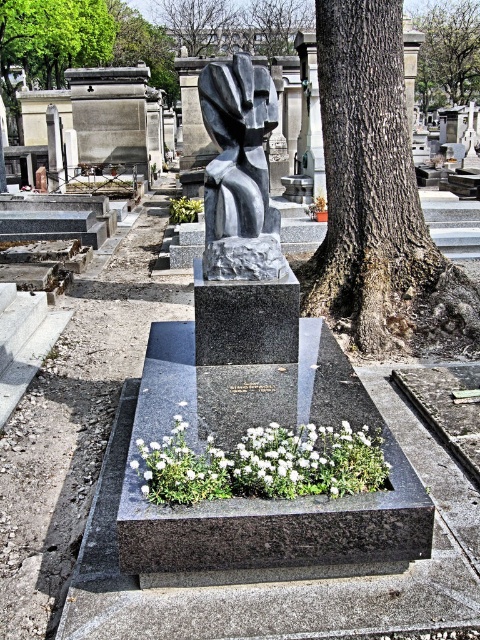
You are a visitor at the cemetery and want to take a photo of the green leafy tree at upper left and the brown textured tree at upper center. Which tree is closer to the camera?

The green leafy tree at upper left is positioned under the brown textured tree at upper center, so the brown textured tree at upper center is closer to the camera.

You are standing in front of the grave marker and want to place a new bouquet of white matte flowers at center to the right of the existing green leafy tree at center. Is there enough space between the existing flowers and the tree to do this?

The white matte flowers at center is positioned on the left side of green leafy tree at center, so placing the new bouquet to the right of the existing tree would require space beyond the current arrangement. However, the description does not provide information about the available space beyond the tree, so it cannot be determined.